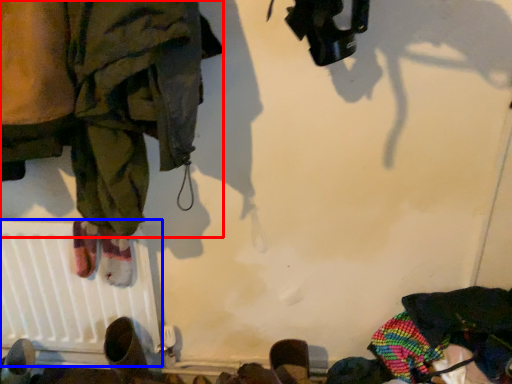
Question: Which point is closer to the camera, clothing (highlighted by a red box) or radiator (highlighted by a blue box)?

Choices:
 (A) clothing
 (B) radiator

Answer: (A)